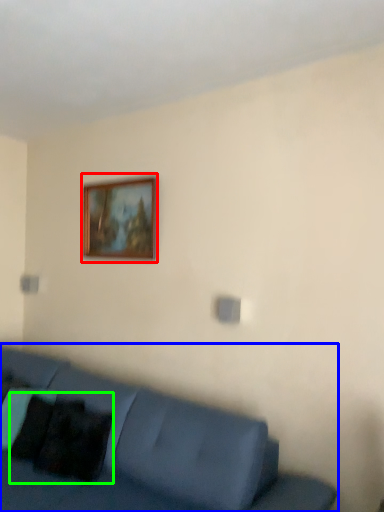
Question: Which object is positioned closest to picture frame (highlighted by a red box)? Select from studio couch (highlighted by a blue box) and pillow (highlighted by a green box).

Choices:
 (A) studio couch
 (B) pillow

Answer: (A)